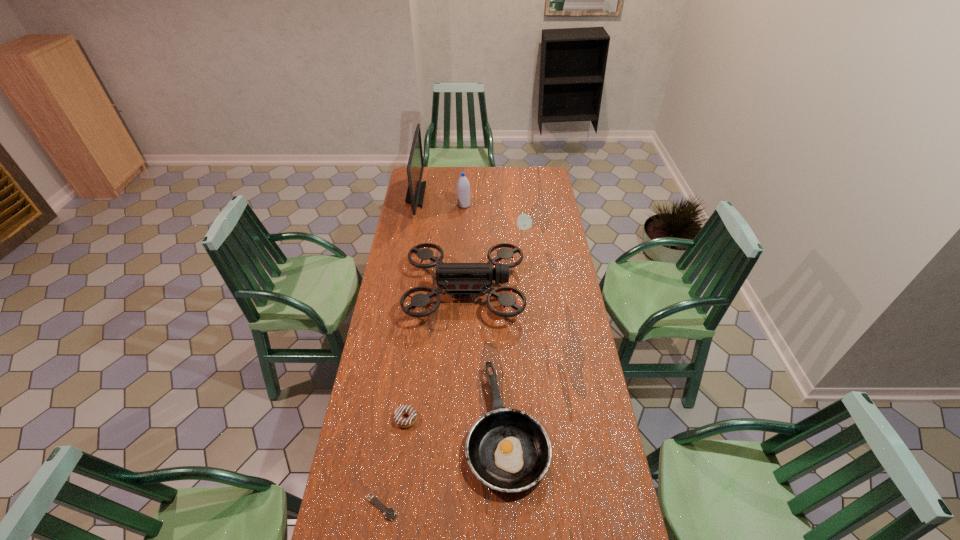
I want to click on watch present at the left edge, so click(x=389, y=513).

Find the location of `object at the far left corner`. object at the far left corner is located at coordinates (416, 189).

This screenshot has height=540, width=960. Find the location of `vacant space at the far edge of the desktop`. vacant space at the far edge of the desktop is located at coordinates (523, 187).

This screenshot has height=540, width=960. In the image, there is a desktop. Identify the location of free space at the left edge. (404, 389).

The height and width of the screenshot is (540, 960). In the image, there is a desktop. Identify the location of free space at the right edge. (569, 330).

The height and width of the screenshot is (540, 960). In order to click on vacant space in between the sixth tallest object and the fifth shortest object in this screenshot , I will do `click(436, 355)`.

At what (x,y) coordinates should I click in order to perform the action: click on vacant space that's between the tallest object and the shortest object. Please return your answer as a coordinate pair (x, y). This screenshot has width=960, height=540. Looking at the image, I should click on (398, 351).

What are the coordinates of `vacant point located between the third farthest object and the tallest object` in the screenshot? It's located at (469, 211).

The image size is (960, 540). What are the coordinates of `free space between the tallest object and the watch` in the screenshot? It's located at (398, 351).

This screenshot has height=540, width=960. In order to click on object that is the second closest to the shortest object in this screenshot , I will do `click(404, 409)`.